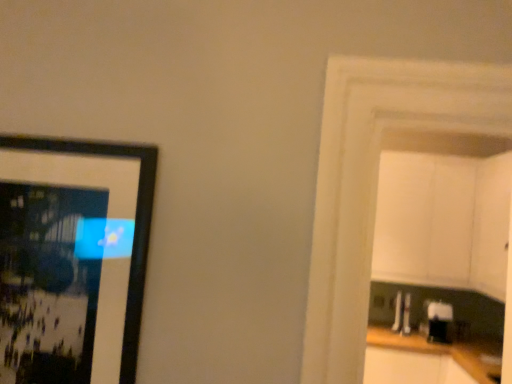
I want to click on black matte picture frame at left, so click(72, 259).

Describe the element at coordinates (72, 259) in the screenshot. This screenshot has height=384, width=512. I see `black matte picture frame at left` at that location.

Image resolution: width=512 pixels, height=384 pixels. I want to click on black matte picture frame at left, so click(x=72, y=259).